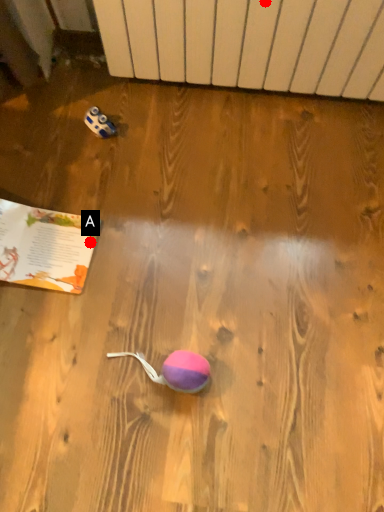
Question: Two points are circled on the image, labeled by A and B beside each circle. Which point is farther from the camera taking this photo?

Choices:
 (A) A is further
 (B) B is further

Answer: (A)